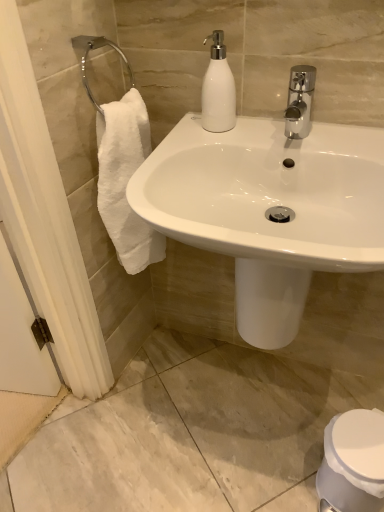
Question: Is white glossy soap dispenser at upper center inside the boundaries of white glossy toilet at lower right, or outside?

Choices:
 (A) inside
 (B) outside

Answer: (B)

Question: Is white glossy soap dispenser at upper center in front of or behind white glossy toilet at lower right in the image?

Choices:
 (A) behind
 (B) front

Answer: (B)

Question: From a real-world perspective, relative to white glossy toilet at lower right, is white glossy soap dispenser at upper center vertically above or below?

Choices:
 (A) below
 (B) above

Answer: (B)

Question: In the image, is white glossy toilet at lower right positioned in front of or behind white glossy soap dispenser at upper center?

Choices:
 (A) front
 (B) behind

Answer: (B)

Question: From the image's perspective, relative to white glossy soap dispenser at upper center, is white glossy toilet at lower right above or below?

Choices:
 (A) below
 (B) above

Answer: (A)

Question: Does point (349, 456) appear closer or farther from the camera than point (216, 110)?

Choices:
 (A) farther
 (B) closer

Answer: (A)

Question: From a real-world perspective, is white glossy toilet at lower right above or below white glossy soap dispenser at upper center?

Choices:
 (A) below
 (B) above

Answer: (A)